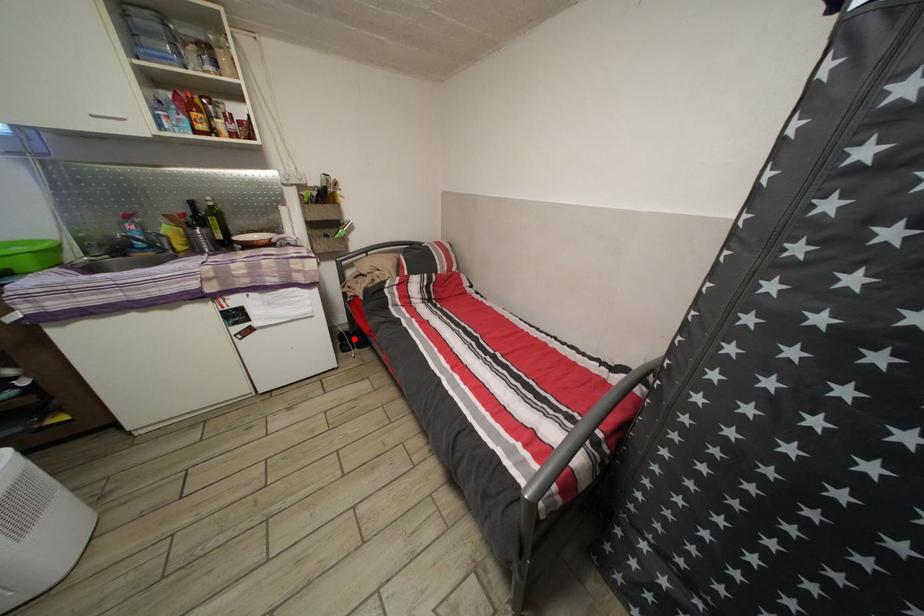
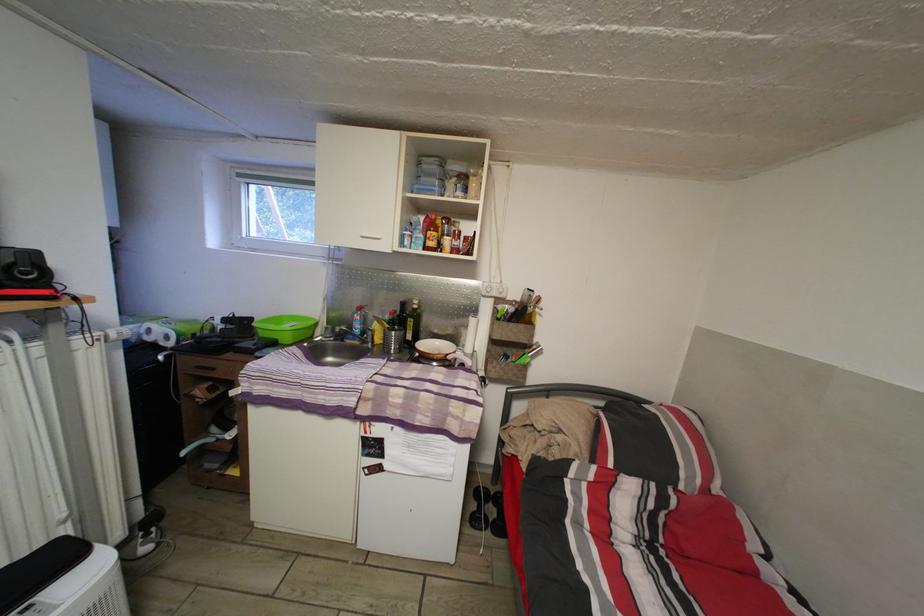
Question: I am providing you with two images of the same scene from different viewpoints. A red point is shown in image1. For the corresponding object point in image2, is it positioned nearer or farther from the camera?

Choices:
 (A) Nearer
 (B) Farther

Answer: (A)